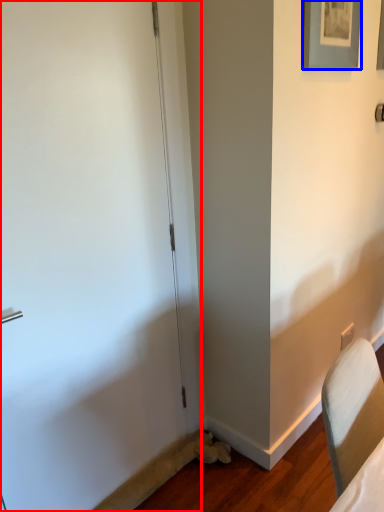
Question: Which of the following is the closest to the observer, door (highlighted by a red box) or picture frame (highlighted by a blue box)?

Choices:
 (A) door
 (B) picture frame

Answer: (A)